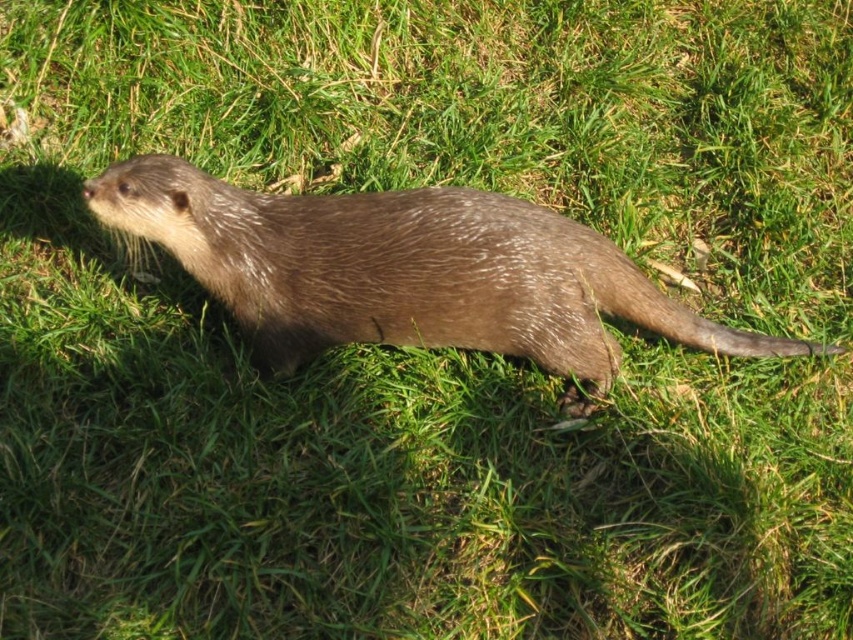
Question: Among these points, which one is nearest to the camera?

Choices:
 (A) (106, 209)
 (B) (631, 269)

Answer: (A)

Question: Can you confirm if brown furry otter at center is positioned below brown furry tail at lower right?

Choices:
 (A) yes
 (B) no

Answer: (B)

Question: Which of the following is the closest to the observer?

Choices:
 (A) brown furry otter at center
 (B) brown furry tail at lower right

Answer: (A)

Question: Is brown furry otter at center in front of brown furry tail at lower right?

Choices:
 (A) no
 (B) yes

Answer: (B)

Question: Does brown furry otter at center have a greater width compared to brown furry tail at lower right?

Choices:
 (A) yes
 (B) no

Answer: (A)